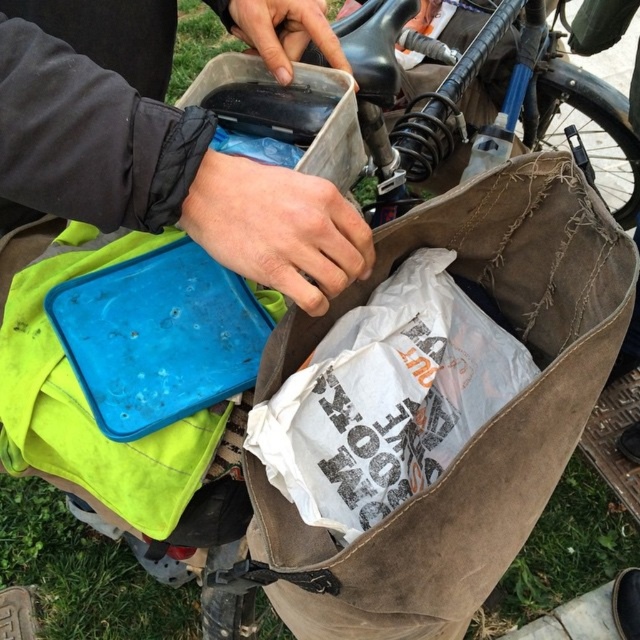
From the picture: You are trying to determine if the brown canvas bag at center can fit inside the matte plastic container at upper center based on their sizes. Can it fit?

The brown canvas bag at center is thinner than the matte plastic container at upper center, so it cannot fit inside because the container is thicker.

You are taking a photo of the bicycle basket and want to focus on the items inside. Based on their positions, which point should you adjust your focus to prioritize the item at point [536,448] over the one at point [355,275]?

Point [536,448] is further to the camera than point [355,275], so adjusting focus to prioritize the item at point [536,448] would ensure it is in focus while the other may be slightly blurred.